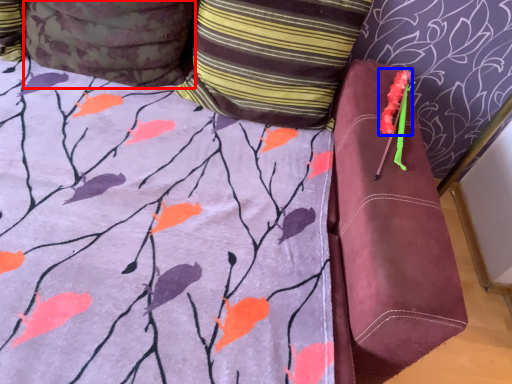
Question: Among these objects, which one is nearest to the camera, pillow (highlighted by a red box) or flower (highlighted by a blue box)?

Choices:
 (A) pillow
 (B) flower

Answer: (A)